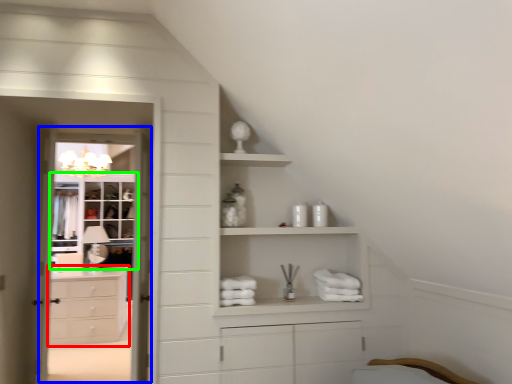
Question: Which is nearer to the chest of drawers (highlighted by a red box)? screen door (highlighted by a blue box) or cupboard (highlighted by a green box).

Choices:
 (A) screen door
 (B) cupboard

Answer: (B)